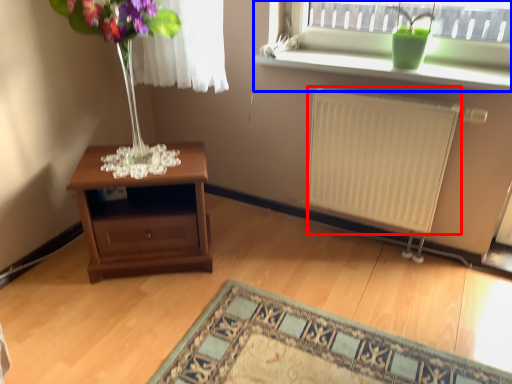
Question: Which point is further to the camera, radiator (highlighted by a red box) or window (highlighted by a blue box)?

Choices:
 (A) radiator
 (B) window

Answer: (B)